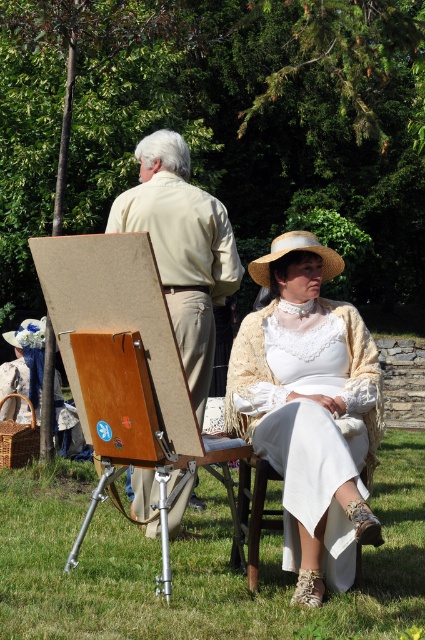
You are planning to set up a small picnic basket on the green grass at lower center. Considering the space available, will the area be sufficient to place the basket without it overlapping with the wooden easel at center?

The green grass at lower center occupies less space than the wooden easel at center, so the area may not be sufficient to place the picnic basket without overlapping with the wooden easel at center.

You are a photographer standing at the edge of the grassy area. You want to take a photo of the light beige shirt at center and the green grass at lower center in the same frame. Can you position yourself so that both are visible without moving the objects?

The green grass at lower center is 5.47 feet away from the light beige shirt at center. Since both objects are within a close proximity, you can position yourself at a distance where both are visible in the frame without needing to move the objects.

You are standing in the outdoor scene and want to place a small potted plant between the green grass at lower center and the light beige shirt at center. Based on their positions, which object should the potted plant be closer to?

The green grass at lower center is closer to the viewer than the light beige shirt at center, so the potted plant should be placed closer to the light beige shirt at center to maintain the spatial relationship between the two objects.